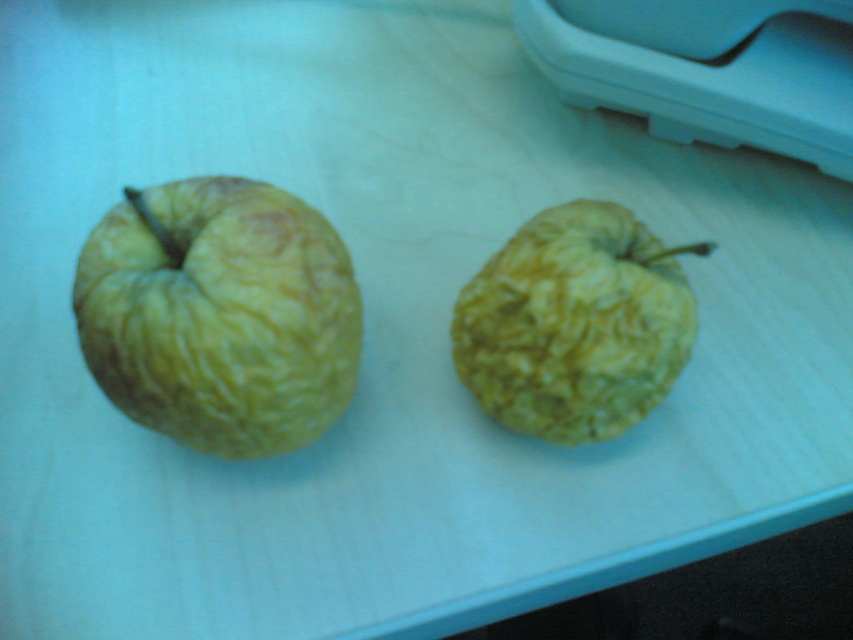
Question: Which point is closer to the camera?

Choices:
 (A) 190,328
 (B) 619,422
 (C) 589,68

Answer: (A)

Question: Can you confirm if yellow wrinkled apple at left is positioned below yellow wrinkled apple at center?

Choices:
 (A) no
 (B) yes

Answer: (A)

Question: Does yellow wrinkled apple at left come behind yellow wrinkled apple at center?

Choices:
 (A) yes
 (B) no

Answer: (B)

Question: Is yellow wrinkled apple at left bigger than yellow wrinkled apple at center?

Choices:
 (A) yes
 (B) no

Answer: (A)

Question: Considering the real-world distances, which object is farthest from the yellow wrinkled apple at left?

Choices:
 (A) yellow wrinkled apple at center
 (B) blue plastic printer at upper right

Answer: (B)

Question: Among these objects, which one is farthest from the camera?

Choices:
 (A) yellow wrinkled apple at center
 (B) blue plastic printer at upper right
 (C) yellow wrinkled apple at left

Answer: (B)